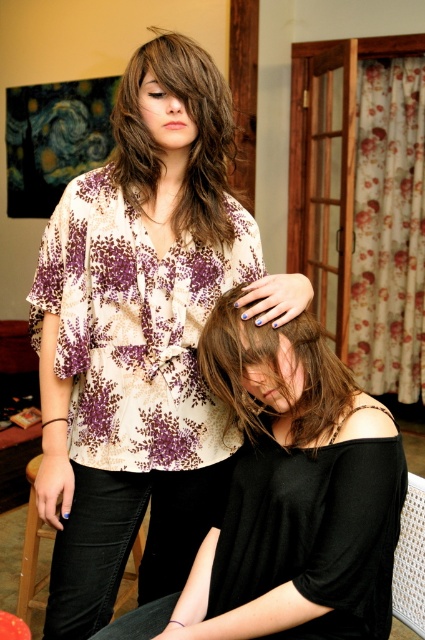
What are the coordinates of the brown matte hair at center?

The brown matte hair at center is located at point (274, 372).

You are a delivery robot with a package that is 12 inches wide. You need to move from the entrance to the living room to deliver the package. There is a narrow pathway between the black matte hair at center and the woven fabric chair at lower right. Can you fit through this pathway?

The distance between the black matte hair at center and the woven fabric chair at lower right is 11.04 inches. Since your package is 12 inches wide, it is slightly wider than the available space. Therefore, you cannot fit through the pathway.

You are an interior designer analyzing the spatial layout of this domestic scene. The black matte hair at center is located at coordinates 0.780, 0.685. If you were to place a small decorative item exactly at this point, where would it be positioned relative to the two individuals?

The black matte hair at center is located at coordinates (291, 499), which is on the seated individual. Therefore, placing a small decorative item at this point would position it on the seated individual.